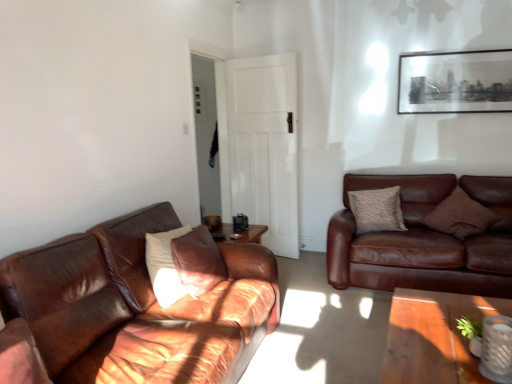
Question: From a real-world perspective, is textured brown pillow at right, the 2th pillow in the right-to-left sequence, positioned above or below brown leather couch at left, the 2th studio couch viewed from the back?

Choices:
 (A) below
 (B) above

Answer: (B)

Question: Is textured brown pillow at right, the 2th pillow in the right-to-left sequence, spatially inside brown leather couch at left, the 2th studio couch in the right-to-left sequence, or outside of it?

Choices:
 (A) outside
 (B) inside

Answer: (A)

Question: Considering the real-world distances, which object is closest to the brown leather couch at right, the 2th studio couch in the left-to-right sequence?

Choices:
 (A) brown textured pillow at right, which is the 3th pillow from left to right
 (B) black matte picture frame at upper right
 (C) white matte pillow at left, arranged as the first pillow when viewed from the left
 (D) brown leather couch at left, the 2th studio couch viewed from the back
 (E) textured brown pillow at right, which is the 1th pillow from back to front

Answer: (A)

Question: Which object is positioned farthest from the textured brown pillow at right, which is the 1th pillow from back to front?

Choices:
 (A) brown leather couch at right, the second studio couch positioned from the front
 (B) brown textured pillow at right, which is the 3th pillow from left to right
 (C) white matte pillow at left, the 3th pillow in the back-to-front sequence
 (D) black matte picture frame at upper right
 (E) white matte door at center

Answer: (C)